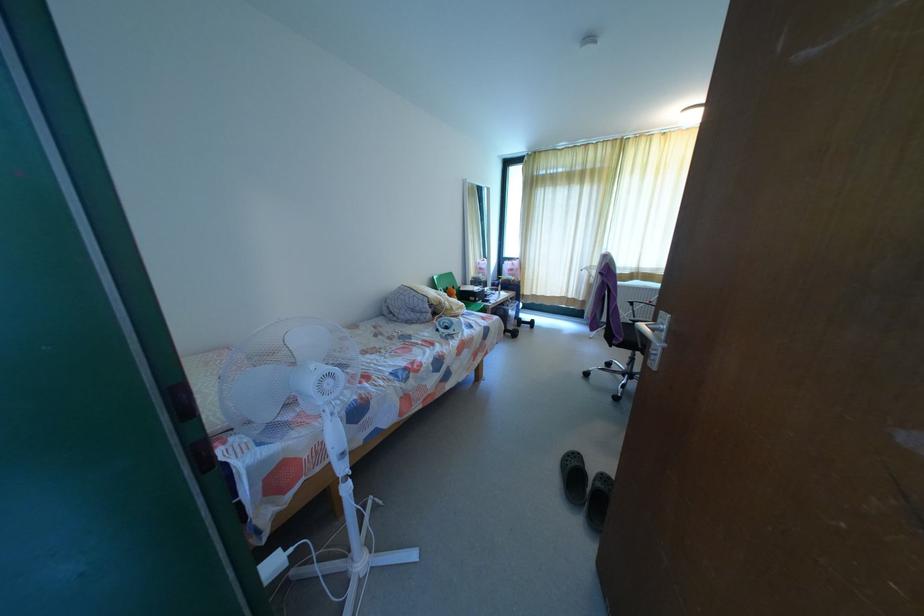
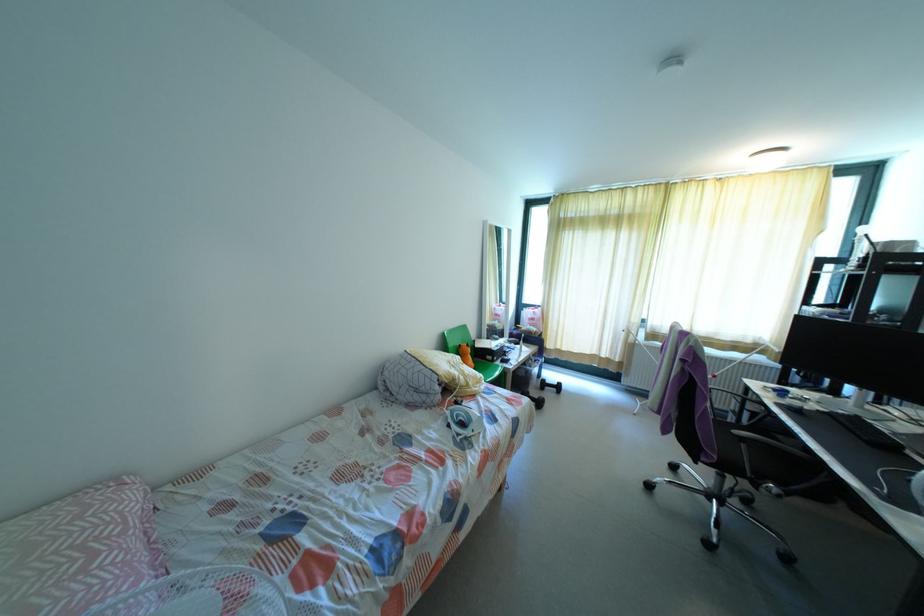
Question: Based on the continuous images, in which direction is the camera rotating? Reply with the corresponding letter.

Choices:
 (A) Left
 (B) Right
 (C) Up
 (D) Down

Answer: (C)